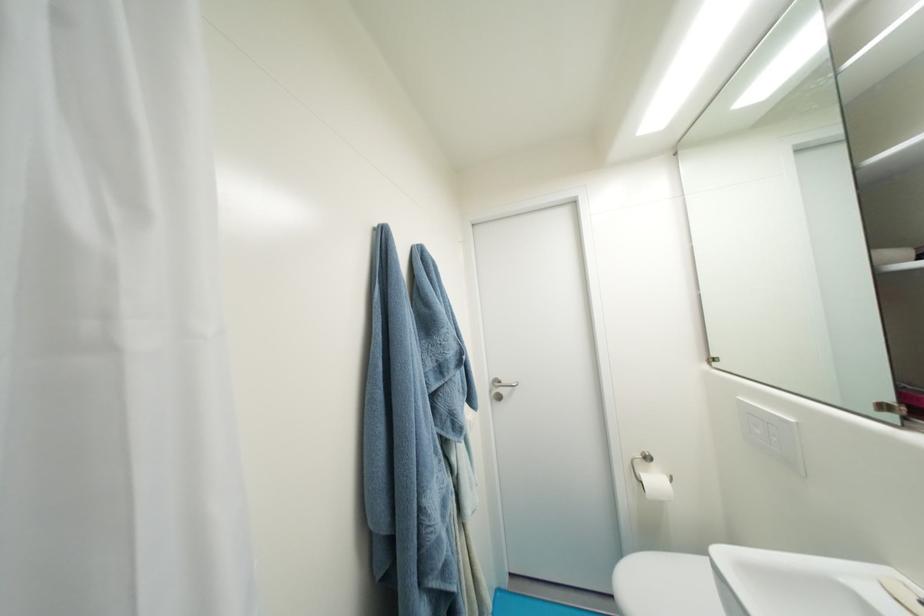
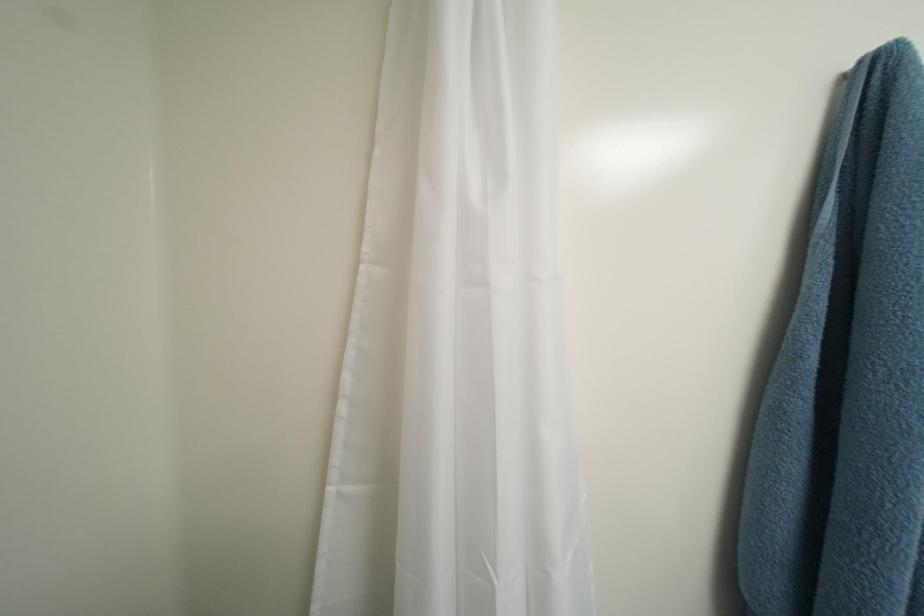
Question: The camera is either moving clockwise (left) or counter-clockwise (right) around the object. The first image is from the beginning of the video and the second image is from the end. Is the camera moving left or right when shooting the video?

Choices:
 (A) Left
 (B) Right

Answer: (B)